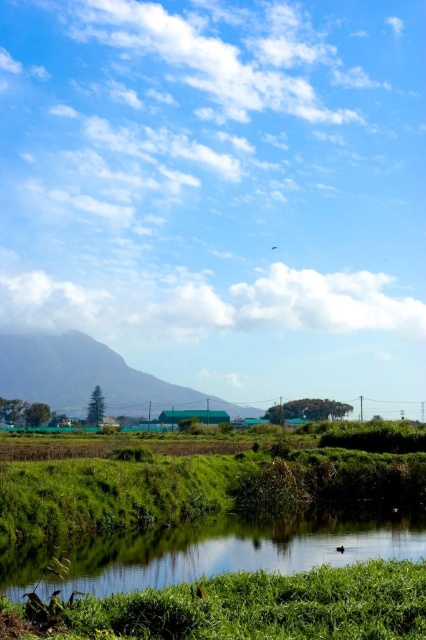
Question: Which point is closer to the camera taking this photo?

Choices:
 (A) (397, 532)
 (B) (344, 618)

Answer: (B)

Question: Is green grass at lower center to the left of green grassy stream at lower center from the viewer's perspective?

Choices:
 (A) no
 (B) yes

Answer: (A)

Question: Can you confirm if green grass at lower center is positioned to the right of green grassy stream at lower center?

Choices:
 (A) no
 (B) yes

Answer: (B)

Question: Can you confirm if green grass at lower center is positioned to the left of green grassy stream at lower center?

Choices:
 (A) yes
 (B) no

Answer: (B)